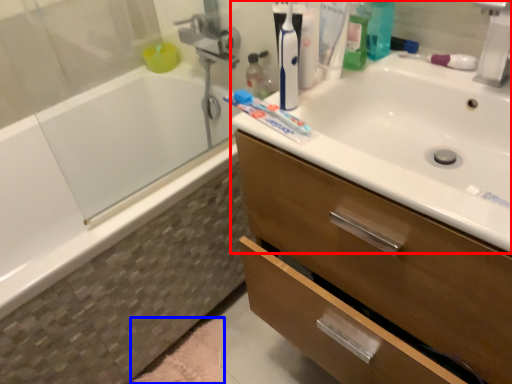
Question: Among these objects, which one is nearest to the camera, sink (highlighted by a red box) or bath mat (highlighted by a blue box)?

Choices:
 (A) sink
 (B) bath mat

Answer: (A)